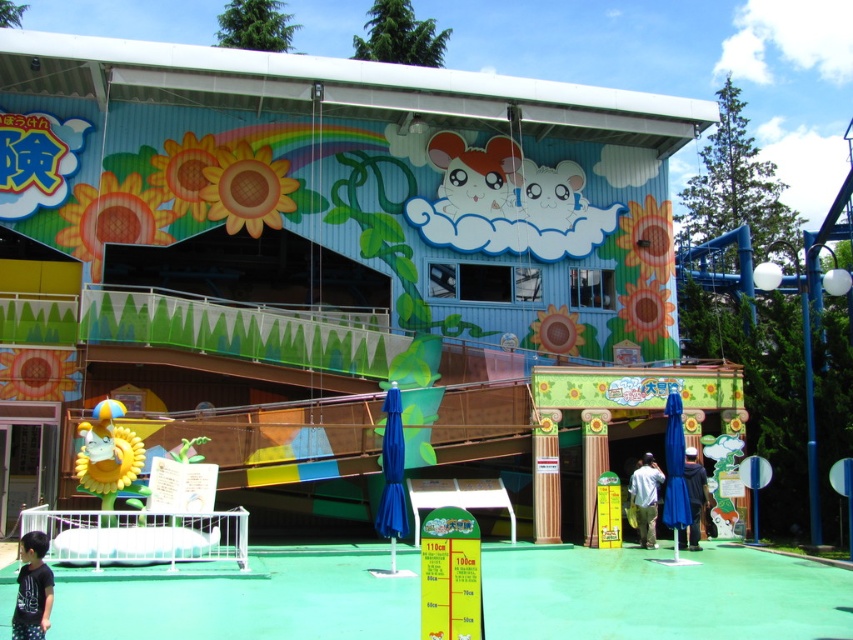
You are a visitor at the amusement park and see the black cotton shirt at lower left and dark blue fabric jacket at lower center. Which clothing item is positioned higher on the image?

The black cotton shirt at lower left is above the dark blue fabric jacket at lower center, so it is positioned higher.

You are standing at the entrance of the colorful building and want to reach the blue umbrella located at point (45, 621). There is a decorative archway at point (699, 493). Which point is closer to your current position?

Point (45, 621) is in front of point (699, 493), so the blue umbrella at point (45, 621) is closer to your current position at the entrance.